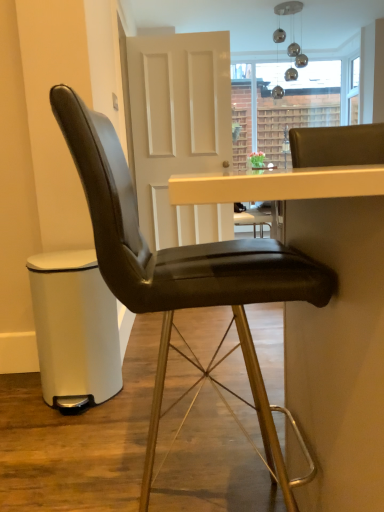
Describe the element at coordinates (182, 270) in the screenshot. I see `black leather chair at center` at that location.

I want to click on white matte door at center, so click(x=180, y=131).

The height and width of the screenshot is (512, 384). Describe the element at coordinates (180, 131) in the screenshot. I see `white matte door at center` at that location.

Locate an element on the screen. black leather chair at center is located at coordinates (182, 270).

Who is smaller, white matte door at center or black leather chair at center?

With smaller size is black leather chair at center.

Which of these two, white matte door at center or black leather chair at center, stands shorter?

With less height is black leather chair at center.

Are white matte door at center and black leather chair at center making contact?

No, white matte door at center is not beside black leather chair at center.

How different are the orientations of white matte door at center and black leather chair at center in degrees?

92.5 degrees.

From the picture: From a real-world perspective, which object rests below the other?

In real-world perspective, matte black bar stool at lower left is lower.

Is black leather chair at center far away from matte black bar stool at lower left?

black leather chair at center is near matte black bar stool at lower left, not far away.

Does black leather chair at center have a lesser width compared to matte black bar stool at lower left?

No, black leather chair at center is not thinner than matte black bar stool at lower left.

In terms of height, does black leather chair at center look taller or shorter compared to matte black bar stool at lower left?

Considering their sizes, black leather chair at center has more height than matte black bar stool at lower left.

Which is more to the left, white matte door at center or black leather table at center?

Positioned to the left is white matte door at center.

Could you tell me if white matte door at center is facing black leather table at center?

Yes, white matte door at center is turned towards black leather table at center.

From a real-world perspective, who is located higher, white matte door at center or black leather table at center?

white matte door at center is physically above.

Can you tell me how much matte black bar stool at lower left and white matte door at center differ in facing direction?

The facing directions of matte black bar stool at lower left and white matte door at center are 3.19 degrees apart.

Can you confirm if matte black bar stool at lower left is positioned to the right of white matte door at center?

In fact, matte black bar stool at lower left is to the left of white matte door at center.

From a real-world perspective, is matte black bar stool at lower left physically below white matte door at center?

Yes, from a real-world perspective, matte black bar stool at lower left is below white matte door at center.

Would you say black leather chair at center is a long distance from white matte door at center?

Yes, black leather chair at center and white matte door at center are quite far apart.

Is black leather chair at center taller or shorter than white matte door at center?

In the image, black leather chair at center appears to be shorter than white matte door at center.

How much distance is there between black leather chair at center and white matte door at center?

2.66 meters.

Which object is positioned more to the left, black leather chair at center or white matte door at center?

white matte door at center is more to the left.

Which is nearer, (x=320, y=169) or (x=238, y=269)?

Positioned in front is point (x=238, y=269).

From the image's perspective, is black leather table at center located beneath black leather chair at center?

Yes.

From a real-world perspective, is black leather table at center positioned above or below black leather chair at center?

black leather table at center is below black leather chair at center.

Is black leather table at center smaller than black leather chair at center?

No.

Is white matte door at center not within matte black bar stool at lower left?

white matte door at center lies outside matte black bar stool at lower left's area.

Which is closer, (167, 102) or (84, 317)?

The point (84, 317) is more forward.

Are white matte door at center and matte black bar stool at lower left located far from each other?

white matte door at center is positioned a significant distance from matte black bar stool at lower left.

Image resolution: width=384 pixels, height=512 pixels. In order to click on bar stool on the left of white matte door at center in this screenshot , I will do `click(77, 329)`.

At what (x,y) coordinates should I click in order to perform the action: click on chair located below the white matte door at center (from the image's perspective). Please return your answer as a coordinate pair (x, y). Looking at the image, I should click on coord(182,270).

The width and height of the screenshot is (384, 512). In order to click on chair above the matte black bar stool at lower left (from the image's perspective) in this screenshot , I will do `click(182, 270)`.

Estimate the real-world distances between objects in this image. Which object is further from matte black bar stool at lower left, black leather chair at center or black leather table at center?

black leather table at center lies further to matte black bar stool at lower left than the other object.

Considering their positions, is black leather chair at center positioned further to black leather table at center than white matte door at center?

white matte door at center is further to black leather table at center.

From the image, which object appears to be farther from matte black bar stool at lower left, black leather table at center or black leather chair at center?

The object further to matte black bar stool at lower left is black leather table at center.

From the image, which object appears to be nearer to black leather chair at center, matte black bar stool at lower left or black leather table at center?

black leather table at center is closer to black leather chair at center.

Estimate the real-world distances between objects in this image. Which object is closer to black leather chair at center, white matte door at center or black leather table at center?

Based on the image, black leather table at center appears to be nearer to black leather chair at center.

Estimate the real-world distances between objects in this image. Which object is further from white matte door at center, black leather chair at center or matte black bar stool at lower left?

black leather chair at center is positioned further to the anchor white matte door at center.

Considering their positions, is black leather chair at center positioned further to white matte door at center than black leather table at center?

Among the two, black leather table at center is located further to white matte door at center.

When comparing their distances from black leather chair at center, does matte black bar stool at lower left or white matte door at center seem further?

white matte door at center lies further to black leather chair at center than the other object.

Locate an element on the screen. The image size is (384, 512). chair positioned between black leather table at center and white matte door at center from near to far is located at coordinates (182, 270).

Locate an element on the screen. The image size is (384, 512). bar stool located between black leather chair at center and white matte door at center in the depth direction is located at coordinates (77, 329).

This screenshot has width=384, height=512. I want to click on bar stool between black leather table at center and white matte door at center along the z-axis, so click(77, 329).

At what (x,y) coordinates should I click in order to perform the action: click on chair positioned between black leather table at center and matte black bar stool at lower left from near to far. Please return your answer as a coordinate pair (x, y). The height and width of the screenshot is (512, 384). Looking at the image, I should click on pos(182,270).